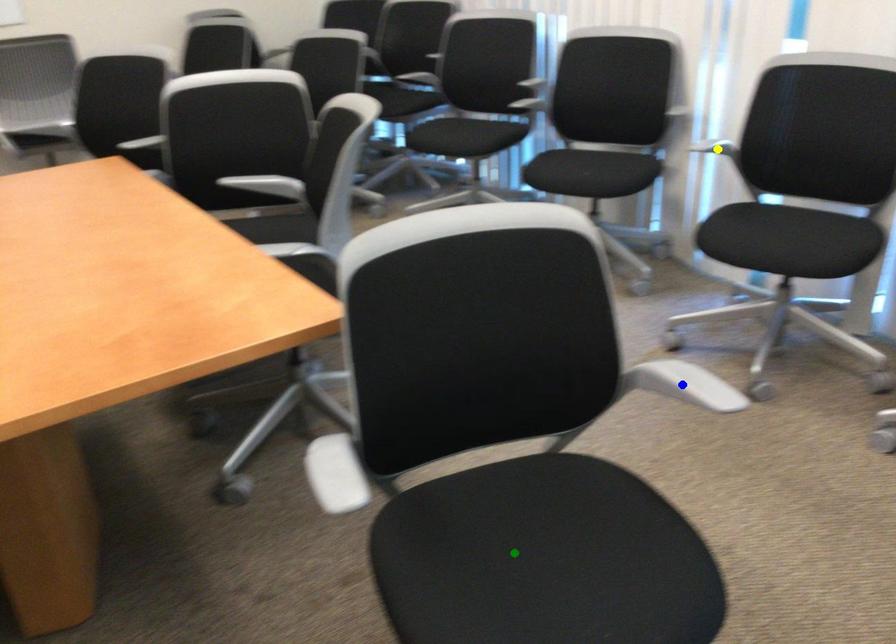
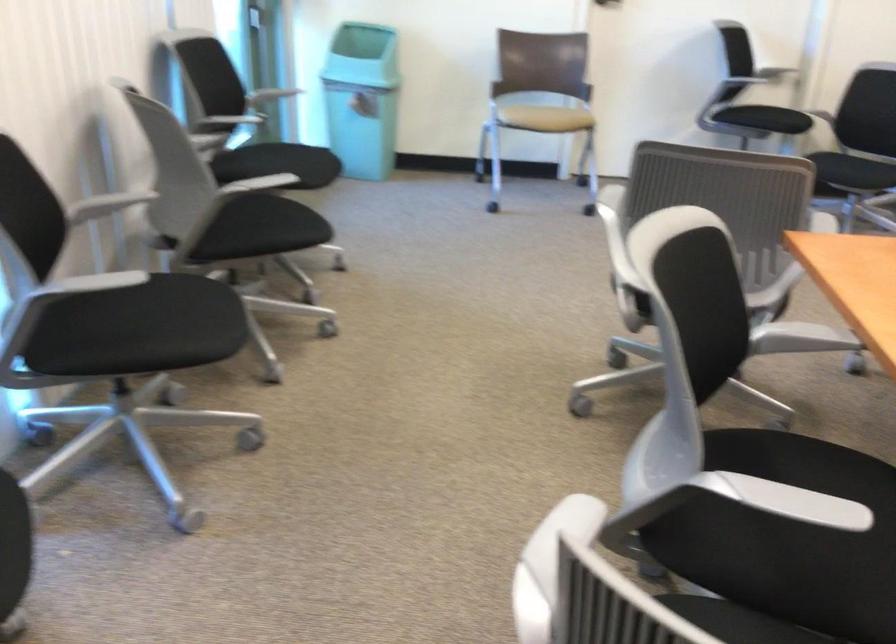
I am providing you with two images of the same scene from different viewpoints. Three points are marked in image1. Which point corresponds to a part or object that is occluded in image2?In image1, three points are marked. Which of them correspond to a part or object that is occluded in image2?Among the three points shown in image1, which one corresponds to a part or object that is no longer visible due to occlusion in image2?

green point, blue point, yellow point cannot be seen in image2.